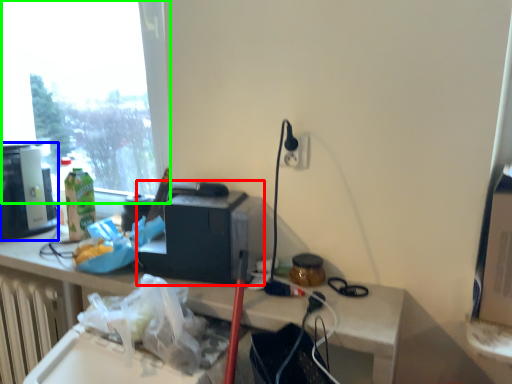
Question: Considering the real-world distances, which object is closest to appliance (highlighted by a red box)? coffee machine (highlighted by a blue box) or window (highlighted by a green box).

Choices:
 (A) coffee machine
 (B) window

Answer: (A)